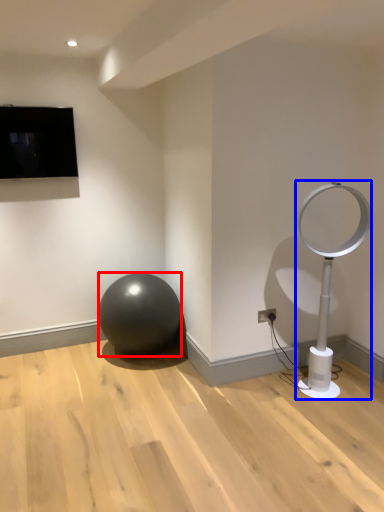
Question: Which object appears farthest to the camera in this image, ball (highlighted by a red box) or lamp (highlighted by a blue box)?

Choices:
 (A) ball
 (B) lamp

Answer: (A)